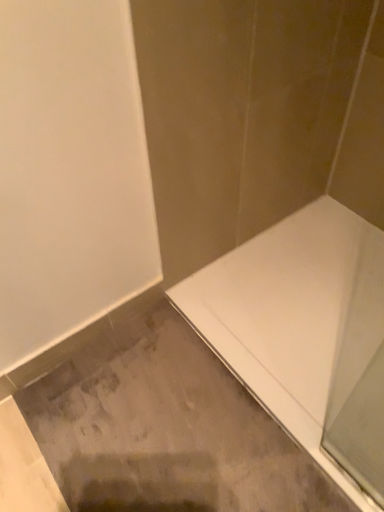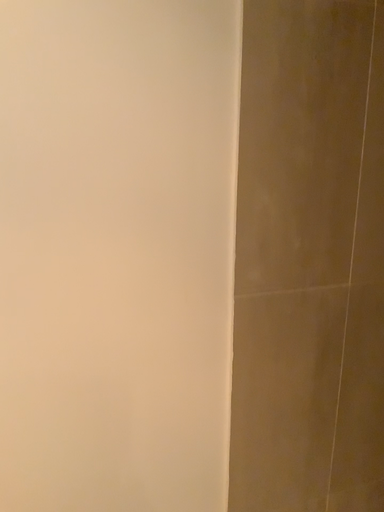
Question: Which way did the camera rotate in the video?

Choices:
 (A) rotated upward
 (B) rotated downward

Answer: (A)